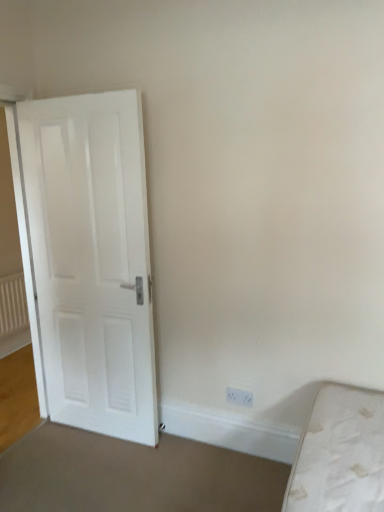
This screenshot has width=384, height=512. Identify the location of blank space to the left of white matte door at left. (49, 448).